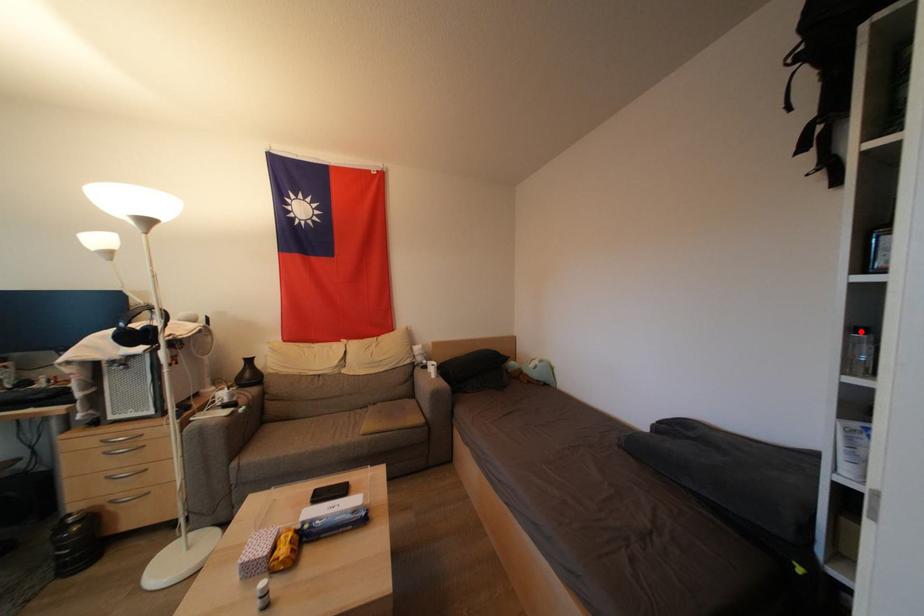
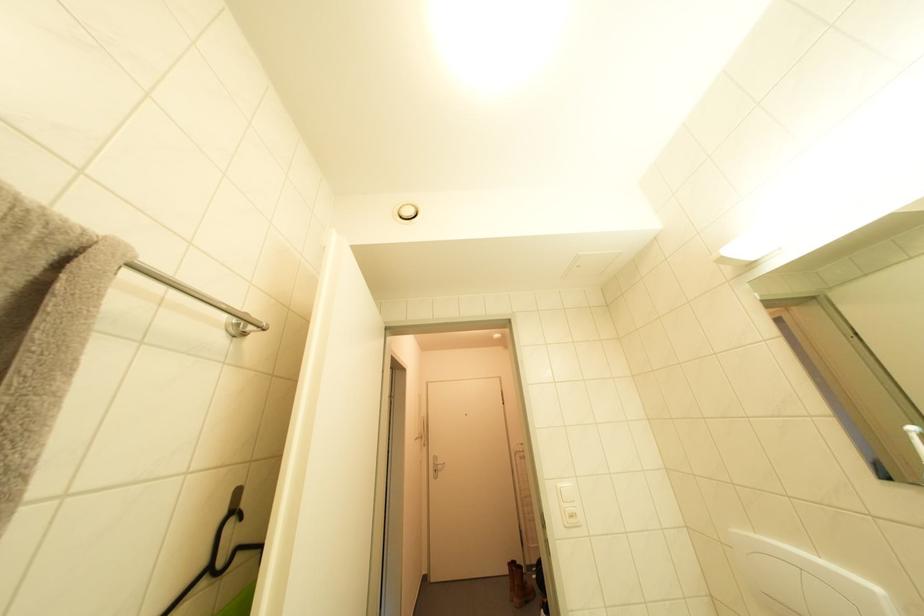
Question: I am providing you with two images of the same scene from different viewpoints. A red point is marked on the first image. At the location where the point appears in image 1, is it still visible in image 2?

Choices:
 (A) Yes
 (B) No

Answer: (B)